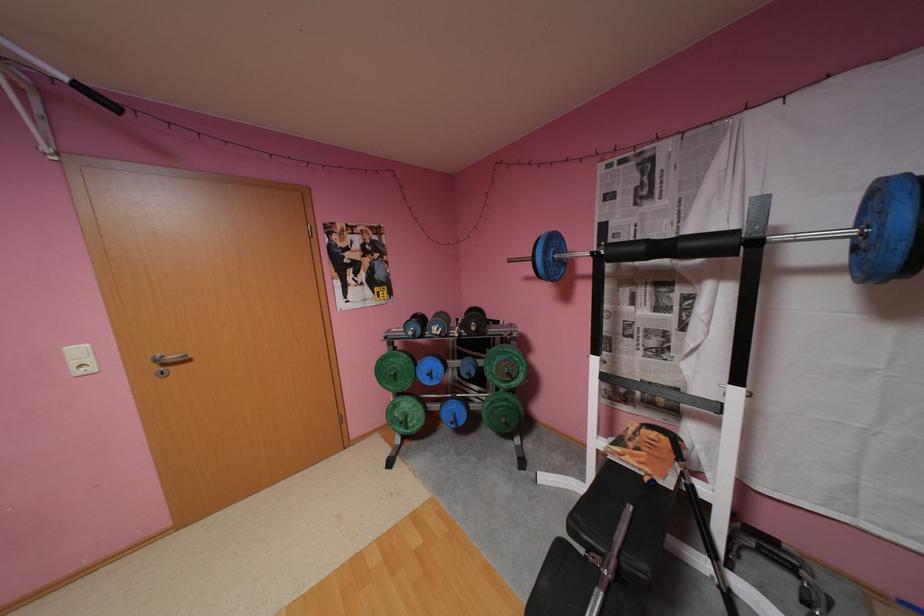
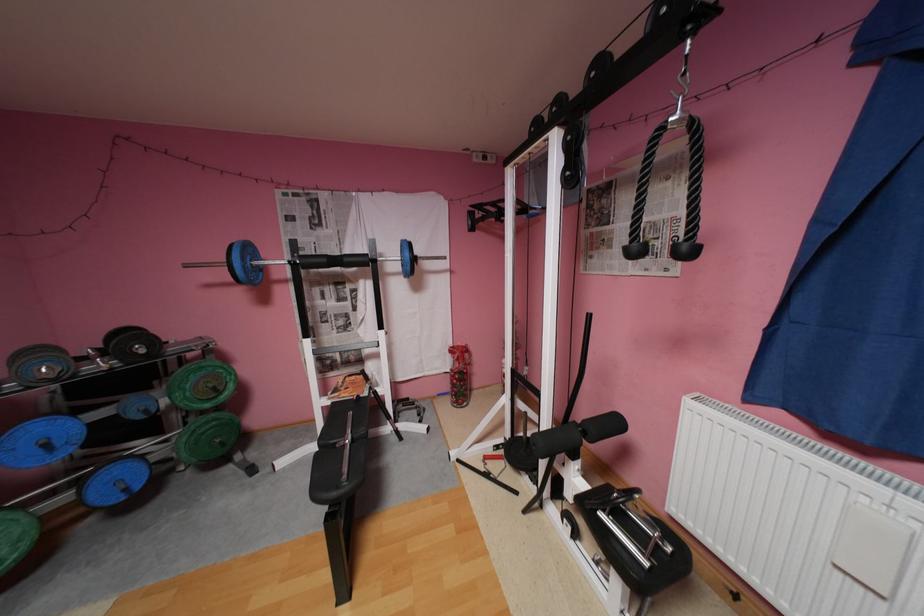
Question: The camera is either moving clockwise (left) or counter-clockwise (right) around the object. The first image is from the beginning of the video and the second image is from the end. Is the camera moving left or right when shooting the video?

Choices:
 (A) Left
 (B) Right

Answer: (A)